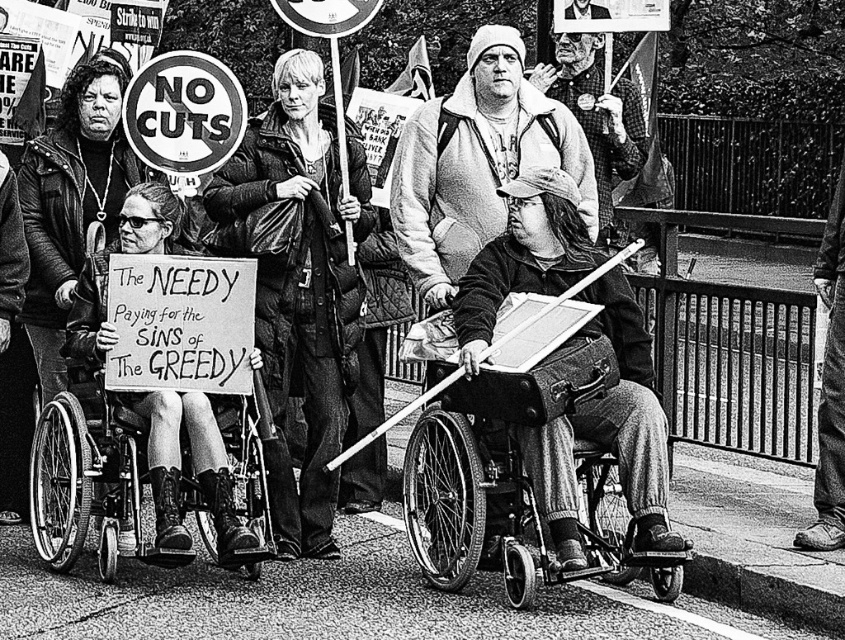
Question: Is metallic wheelchair at lower left below checkered flannel shirt at center?

Choices:
 (A) yes
 (B) no

Answer: (A)

Question: Which of the following is the closest to the observer?

Choices:
 (A) metallic wheelchair at lower left
 (B) matte black wheelchair at left
 (C) white cotton hoodie at center

Answer: (A)

Question: Which of the following is the closest to the observer?

Choices:
 (A) (488, 424)
 (B) (132, 202)

Answer: (A)

Question: Can you confirm if black plastic wheelchair at center is positioned to the left of matte black wheelchair at left?

Choices:
 (A) yes
 (B) no

Answer: (B)

Question: Can you confirm if metallic wheelchair at lower left is wider than matte black wheelchair at left?

Choices:
 (A) no
 (B) yes

Answer: (B)

Question: Among these points, which one is nearest to the camera?

Choices:
 (A) (418, 205)
 (B) (167, 403)
 (C) (511, 534)
 (D) (623, 113)

Answer: (B)